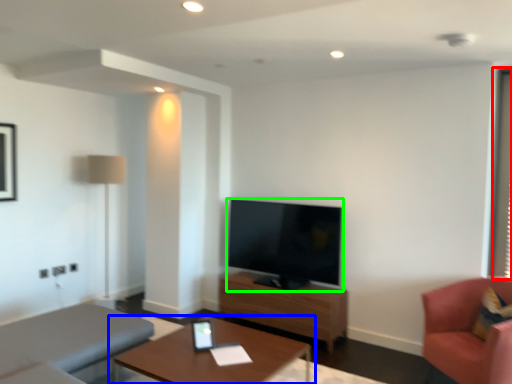
Question: Estimate the real-world distances between objects in this image. Which object is closer to window screen (highlighted by a red box), table (highlighted by a blue box) or television (highlighted by a green box)?

Choices:
 (A) table
 (B) television

Answer: (B)